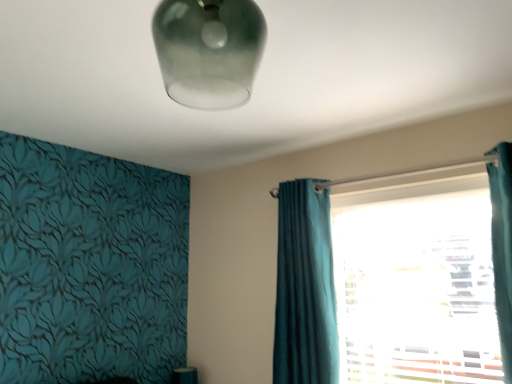
Question: Is point 287,200 positioned closer to the camera than point 326,370?

Choices:
 (A) farther
 (B) closer

Answer: (A)

Question: From the image's perspective, relative to teal fabric curtain at right, is teal velvet curtain at center above or below?

Choices:
 (A) above
 (B) below

Answer: (B)

Question: Which is farther from the teal fabric curtain at right?

Choices:
 (A) teal velvet curtain at center
 (B) frosted glass lampshade at upper center

Answer: (B)

Question: Which object is the closest to the frosted glass lampshade at upper center?

Choices:
 (A) teal velvet curtain at center
 (B) teal fabric curtain at right

Answer: (A)